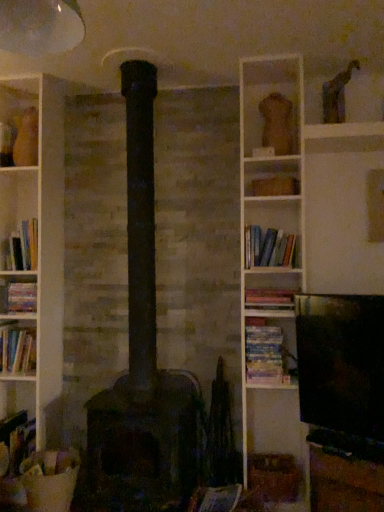
Question: Is dark gray stone stove at center looking in the opposite direction of hardcover book at left, which appears as the 3th book when viewed from the top?

Choices:
 (A) yes
 (B) no

Answer: (B)

Question: Is dark gray stone stove at center positioned beyond the bounds of hardcover book at left, which appears as the 3th book when viewed from the top?

Choices:
 (A) no
 (B) yes

Answer: (B)

Question: Is dark gray stone stove at center not close to hardcover book at left, acting as the fourth book starting from the bottom?

Choices:
 (A) no
 (B) yes

Answer: (A)

Question: Does dark gray stone stove at center have a larger size compared to hardcover book at left, which appears as the 3th book when viewed from the top?

Choices:
 (A) yes
 (B) no

Answer: (A)

Question: Is hardcover book at left, which appears as the 3th book when viewed from the top, completely or partially inside dark gray stone stove at center?

Choices:
 (A) no
 (B) yes

Answer: (A)

Question: Visually, is hardcover books at center-right, acting as the fourth book starting from the left, positioned to the left or to the right of hardcover books at left, the fifth book positioned from the right?

Choices:
 (A) left
 (B) right

Answer: (B)

Question: Considering the positions of point (256, 322) and point (29, 246), is point (256, 322) closer or farther from the camera than point (29, 246)?

Choices:
 (A) closer
 (B) farther

Answer: (A)

Question: From the image's perspective, is hardcover books at center-right, acting as the fourth book starting from the left, above or below hardcover books at left, which is the 6th book in bottom-to-top order?

Choices:
 (A) above
 (B) below

Answer: (B)

Question: In terms of size, does hardcover books at center-right, acting as the fourth book starting from the left, appear bigger or smaller than hardcover books at left, the 2th book in the left-to-right sequence?

Choices:
 (A) big
 (B) small

Answer: (B)

Question: Is point (317, 458) closer or farther from the camera than point (24, 289)?

Choices:
 (A) closer
 (B) farther

Answer: (A)

Question: Is wooden at center, the first shelf from the right, to the left or to the right of hardcover book at left, which appears as the 3th book when viewed from the top, in the image?

Choices:
 (A) left
 (B) right

Answer: (B)

Question: Considering their positions, is wooden at center, which is counted as the 2th shelf, starting from the top, located in front of or behind hardcover book at left, acting as the 4th book starting from the right?

Choices:
 (A) behind
 (B) front

Answer: (B)

Question: From the image's perspective, is wooden at center, which is counted as the 2th shelf, starting from the top, above or below hardcover book at left, which appears as the 3th book when viewed from the top?

Choices:
 (A) below
 (B) above

Answer: (A)

Question: Considering the positions of dark gray stone stove at center and wooden at center, which is the first shelf in bottom-to-top order, in the image, is dark gray stone stove at center wider or thinner than wooden at center, which is the first shelf in bottom-to-top order,?

Choices:
 (A) wide
 (B) thin

Answer: (B)

Question: In terms of size, does dark gray stone stove at center appear bigger or smaller than wooden at center, marked as the second shelf in a left-to-right arrangement?

Choices:
 (A) big
 (B) small

Answer: (B)